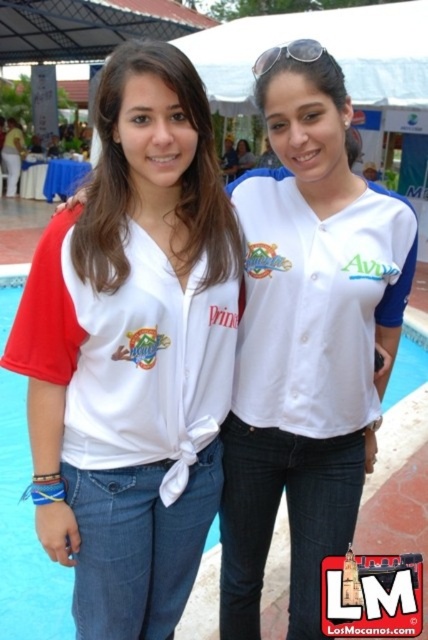
You are a photographer adjusting your camera settings. You notice the white matte jersey at center and the silver metallic sunglasses at upper center in your frame. Which object appears taller in the image?

The silver metallic sunglasses at upper center appears taller than the white matte jersey at center.

You are a photographer setting up equipment for a poolside photoshoot. You have a camera that can focus on objects within a 3 feet range. You see the white matte jersey at center and the silver metallic sunglasses at upper center in the scene. Can your camera focus on both objects at the same time?

The distance between the white matte jersey at center and the silver metallic sunglasses at upper center is 3.63 feet, which exceeds the camera focus range of 3 feet. Therefore, the camera cannot focus on both objects simultaneously.